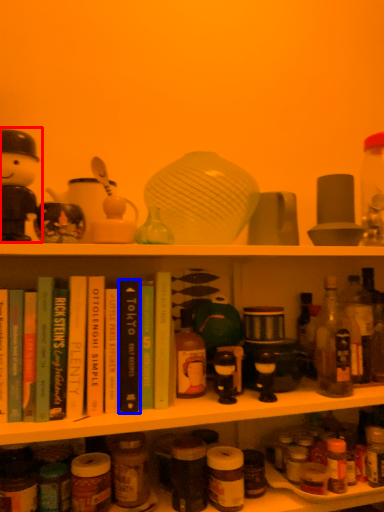
Question: Which object appears closest to the camera in this image, toy (highlighted by a red box) or book (highlighted by a blue box)?

Choices:
 (A) toy
 (B) book

Answer: (A)